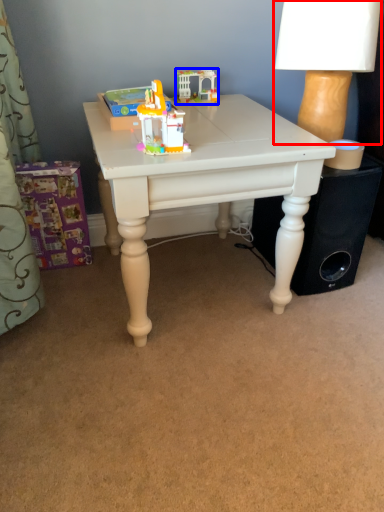
Question: Among these objects, which one is farthest to the camera, table lamp (highlighted by a red box) or toy (highlighted by a blue box)?

Choices:
 (A) table lamp
 (B) toy

Answer: (B)